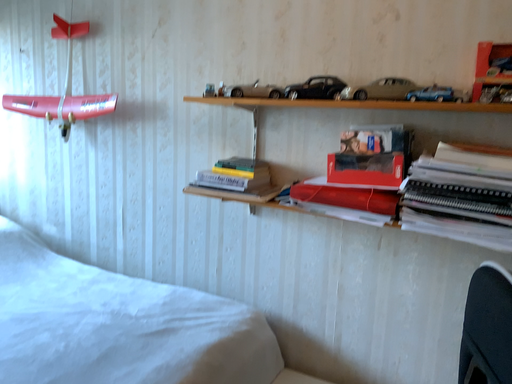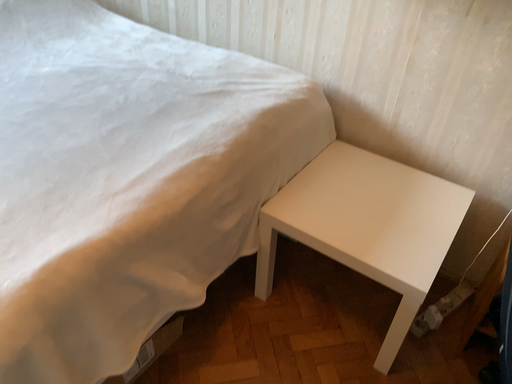
Question: How did the camera likely rotate when shooting the video?

Choices:
 (A) rotated downward
 (B) rotated upward

Answer: (A)